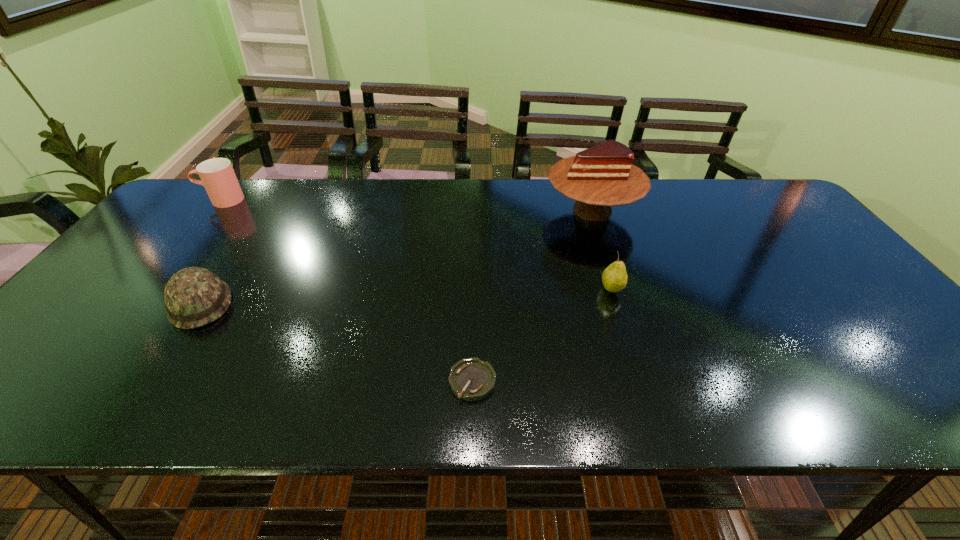
You are a GUI agent. You are given a task and a screenshot of the screen. Output one action in this format:
    pyautogui.click(x=<x>, y=<y>)
    Task: Click on the free space between the nearest object and the fourth shortest object
    
    Given the screenshot: What is the action you would take?
    pyautogui.click(x=347, y=291)

The image size is (960, 540). Identify the location of vacant space that is in between the headwear and the pear. (406, 296).

Point out which object is positioned as the fourth nearest to the cup. Please provide its 2D coordinates. Your answer should be formatted as a tuple, i.e. [(x, y)], where the tuple contains the x and y coordinates of a point satisfying the conditions above.

[(614, 278)]

The image size is (960, 540). Identify the location of the second closest object relative to the headwear. (471, 379).

Where is `vacant space that satisfies the following two spatial constraints: 1. on the back side of the pear; 2. on the left side of the tallest object`? vacant space that satisfies the following two spatial constraints: 1. on the back side of the pear; 2. on the left side of the tallest object is located at coordinates (586, 210).